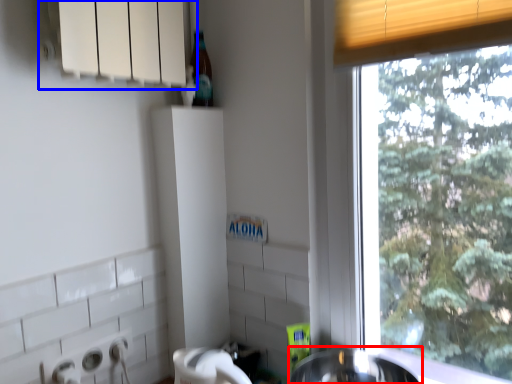
Question: Among these objects, which one is farthest to the camera, sink (highlighted by a red box) or window sill (highlighted by a blue box)?

Choices:
 (A) sink
 (B) window sill

Answer: (A)